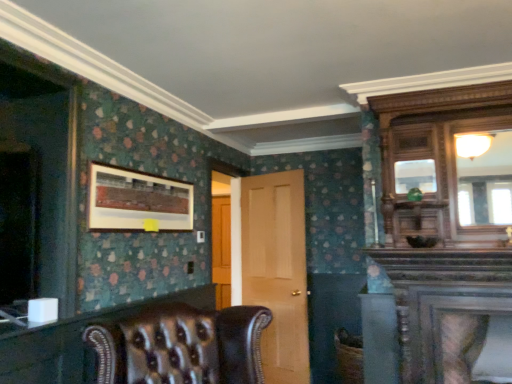
Question: Is leather armchair at center inside or outside of light brown wood door at center?

Choices:
 (A) inside
 (B) outside

Answer: (B)

Question: Is point (158, 367) closer or farther from the camera than point (292, 360)?

Choices:
 (A) farther
 (B) closer

Answer: (B)

Question: Which of these objects is positioned farthest from the wooden carved dresser at upper right, which is the first dresser from top to bottom?

Choices:
 (A) leather at lower left, acting as the second dresser starting from the top
 (B) light brown wood door at center
 (C) leather armchair at center
 (D) wooden-framed artwork at upper left

Answer: (A)

Question: Considering the real-world distances, which object is closest to the light brown wood door at center?

Choices:
 (A) leather at lower left, which ranks as the second dresser in right-to-left order
 (B) wooden-framed artwork at upper left
 (C) wooden carved dresser at upper right, marked as the 1th dresser in a right-to-left arrangement
 (D) leather armchair at center

Answer: (A)